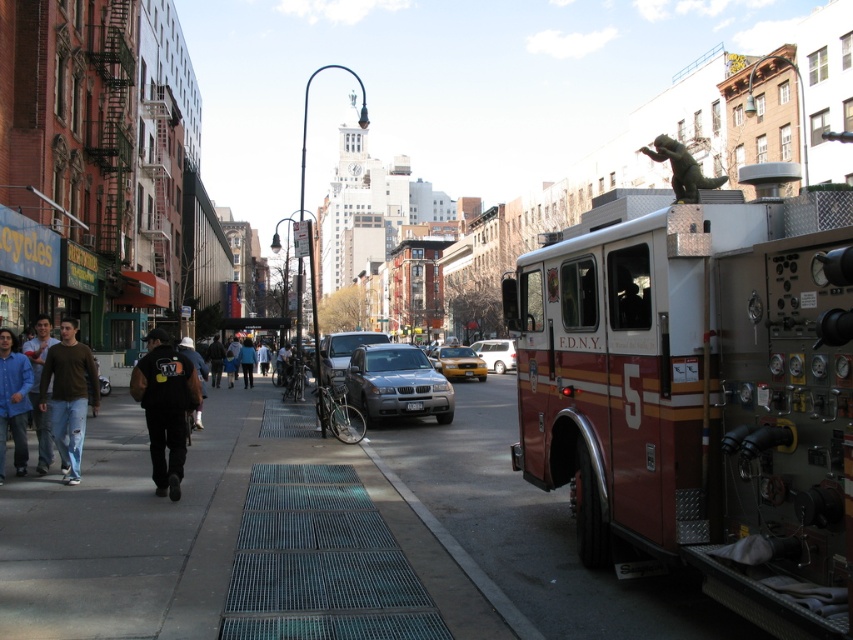
You are a delivery driver needing to park your van in a spot that is centrally located between the FDNY fire truck and the nearest building on the left. Is the silver metallic van at center currently occupying that central spot?

The silver metallic van at center is located at point (496, 353). Since the question asks about a central spot between the FDNY fire truck and the nearest building on the left, but the van is already positioned at the center coordinates, it is occupying that central spot.

You are a delivery driver who needs to park your vehicle in the city. You see the metallic grates at center and the metallic silver suv at center. Which object is closer to you as you approach the street?

The metallic grates at center are closer to you than the metallic silver suv at center because they are positioned in front of it.

You are a delivery driver who needs to park your van between the metallic grates at center and the metallic silver suv at center. Is there enough space for your van, which is 6 meters long, between them?

The metallic grates at center are to the right of the metallic silver suv at center, so there is no space between them for your van to park. You need to look for another spot.